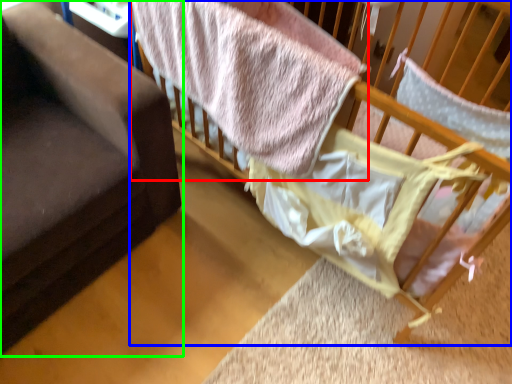
Question: Which object is the farthest from bed (highlighted by a red box)? Choose among these: infant bed (highlighted by a blue box) or furniture (highlighted by a green box).

Choices:
 (A) infant bed
 (B) furniture

Answer: (A)